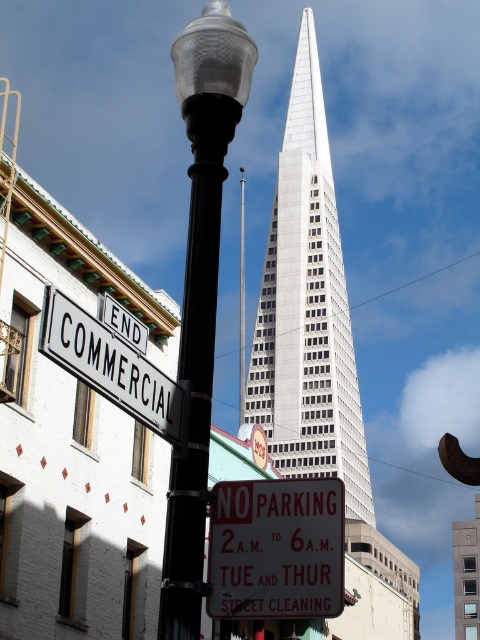
Can you confirm if matte glass lamp post at center is bigger than black metal pole at center?

Incorrect, matte glass lamp post at center is not larger than black metal pole at center.

Is matte glass lamp post at center above black metal pole at center?

Indeed, matte glass lamp post at center is positioned over black metal pole at center.

The height and width of the screenshot is (640, 480). I want to click on matte glass lamp post at center, so point(200,291).

Is point (224, 614) more distant than point (168, 394)?

Yes, it is.

Based on the photo, who is more forward, (236,552) or (46,305)?

Positioned in front is point (46,305).

Which is in front, point (267, 589) or point (48, 333)?

Point (48, 333) is in front.

Identify the location of white plastic sign at center. (276, 548).

Which of these two, white metal sign at upper left or black metal pole at center, stands shorter?

Answer: With less height is white metal sign at upper left.

Can you confirm if white metal sign at upper left is positioned below black metal pole at center?

Yes, white metal sign at upper left is below black metal pole at center.

The height and width of the screenshot is (640, 480). Describe the element at coordinates (112, 368) in the screenshot. I see `white metal sign at upper left` at that location.

The height and width of the screenshot is (640, 480). I want to click on white metal sign at upper left, so click(112, 368).